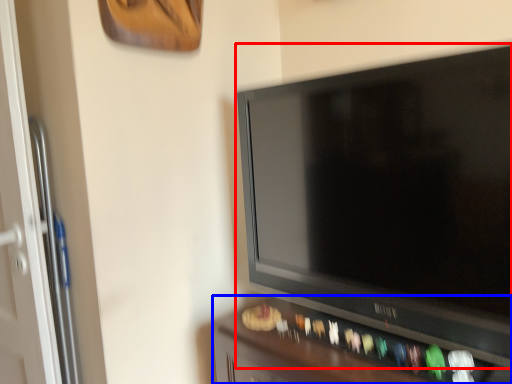
Question: Which object is closer to the camera taking this photo, television (highlighted by a red box) or furniture (highlighted by a blue box)?

Choices:
 (A) television
 (B) furniture

Answer: (A)